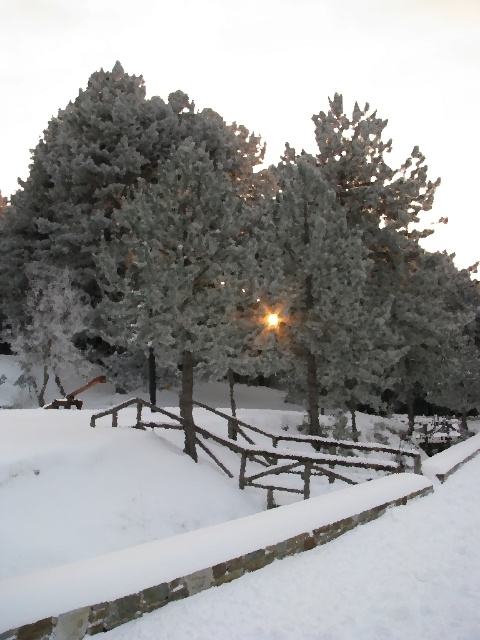
Which is more to the left, white fluffy snow at center or frosted snow-covered tree at upper left?

frosted snow-covered tree at upper left

How much distance is there between white fluffy snow at center and frosted snow-covered tree at upper left?

white fluffy snow at center is 9.13 meters away from frosted snow-covered tree at upper left.

Locate an element on the screen. white fluffy snow at center is located at coordinates (229, 541).

Who is higher up, white fluffy snow at center or brown wooden fence at center?

Positioned higher is white fluffy snow at center.

Image resolution: width=480 pixels, height=640 pixels. What do you see at coordinates (229, 541) in the screenshot?
I see `white fluffy snow at center` at bounding box center [229, 541].

At what (x,y) coordinates should I click in order to perform the action: click on white fluffy snow at center. Please return your answer as a coordinate pair (x, y). Image resolution: width=480 pixels, height=640 pixels. Looking at the image, I should click on pyautogui.click(x=229, y=541).

Between point (241, 160) and point (286, 468), which one is positioned in front?

Point (286, 468) is more forward.

Which is above, frosted snow-covered tree at upper left or brown wooden fence at center?

frosted snow-covered tree at upper left

The height and width of the screenshot is (640, 480). I want to click on frosted snow-covered tree at upper left, so click(x=127, y=209).